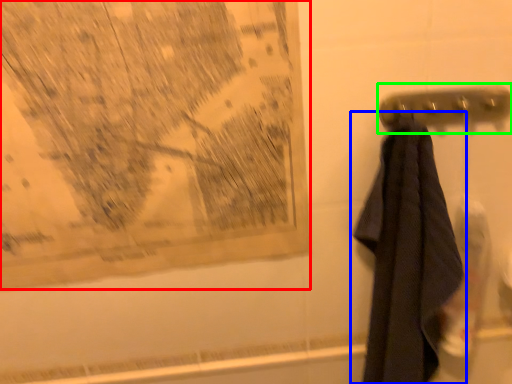
Question: Which is nearer to the map (highlighted by a red box)? towel (highlighted by a blue box) or towel bar (highlighted by a green box).

Choices:
 (A) towel
 (B) towel bar

Answer: (A)